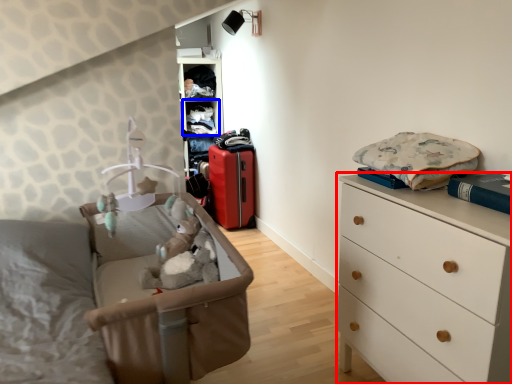
Question: Which point is further to the camera, chest of drawers (highlighted by a red box) or shelf (highlighted by a blue box)?

Choices:
 (A) chest of drawers
 (B) shelf

Answer: (B)